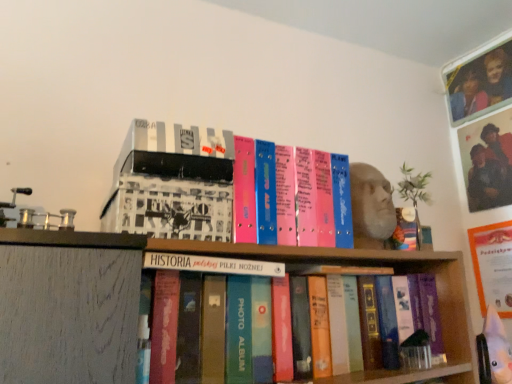
Question: From a real-world perspective, does orange matte paper at upper right stand above white matte box at upper left, acting as the first book starting from the top?

Choices:
 (A) yes
 (B) no

Answer: (B)

Question: Can you confirm if orange matte paper at upper right is wider than white matte box at upper left, which ranks as the 2th book in bottom-to-top order?

Choices:
 (A) no
 (B) yes

Answer: (A)

Question: Is orange matte paper at upper right closer to camera compared to white matte box at upper left, acting as the first book starting from the top?

Choices:
 (A) yes
 (B) no

Answer: (B)

Question: Is there a large distance between orange matte paper at upper right and white matte box at upper left, acting as the first book starting from the top?

Choices:
 (A) no
 (B) yes

Answer: (B)

Question: Does orange matte paper at upper right have a lesser width compared to white matte box at upper left, acting as the first book starting from the top?

Choices:
 (A) yes
 (B) no

Answer: (A)

Question: Considering the positions of point (166, 256) and point (480, 89), is point (166, 256) closer or farther from the camera than point (480, 89)?

Choices:
 (A) closer
 (B) farther

Answer: (A)

Question: Considering their positions, is hardcover book at center, which ranks as the first book in bottom-to-top order, located in front of or behind matte plastic photo frame at upper right?

Choices:
 (A) front
 (B) behind

Answer: (A)

Question: From their relative heights in the image, would you say hardcover book at center, which ranks as the first book in bottom-to-top order, is taller or shorter than matte plastic photo frame at upper right?

Choices:
 (A) tall
 (B) short

Answer: (B)

Question: Is hardcover book at center, which ranks as the first book in bottom-to-top order, situated inside matte plastic photo frame at upper right or outside?

Choices:
 (A) outside
 (B) inside

Answer: (A)

Question: In the image, is matte plastic photo frame at upper right positioned in front of or behind white matte box at upper left, which ranks as the 2th book in bottom-to-top order?

Choices:
 (A) behind
 (B) front

Answer: (A)

Question: Is point (505, 66) positioned closer to the camera than point (113, 195)?

Choices:
 (A) closer
 (B) farther

Answer: (B)

Question: Is matte plastic photo frame at upper right to the left or to the right of white matte box at upper left, which ranks as the 2th book in bottom-to-top order, in the image?

Choices:
 (A) left
 (B) right

Answer: (B)

Question: In terms of width, does matte plastic photo frame at upper right look wider or thinner when compared to white matte box at upper left, which ranks as the 2th book in bottom-to-top order?

Choices:
 (A) wide
 (B) thin

Answer: (B)

Question: Does point (265, 264) appear closer or farther from the camera than point (108, 225)?

Choices:
 (A) farther
 (B) closer

Answer: (A)

Question: Is hardcover book at center, which ranks as the first book in bottom-to-top order, bigger or smaller than white matte box at upper left, which ranks as the 2th book in bottom-to-top order?

Choices:
 (A) small
 (B) big

Answer: (A)